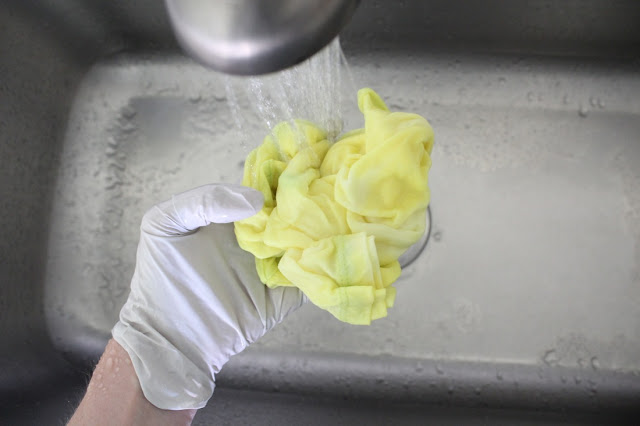
Find the location of `crumpled yellow rag`. crumpled yellow rag is located at coordinates (320, 182).